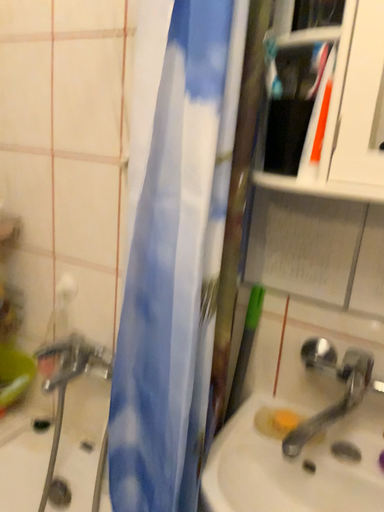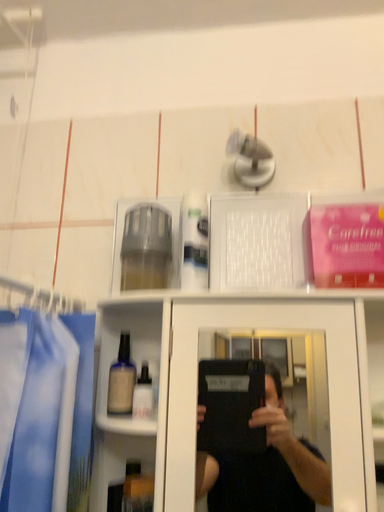
Question: Which way did the camera rotate in the video?

Choices:
 (A) rotated downward
 (B) rotated upward

Answer: (B)